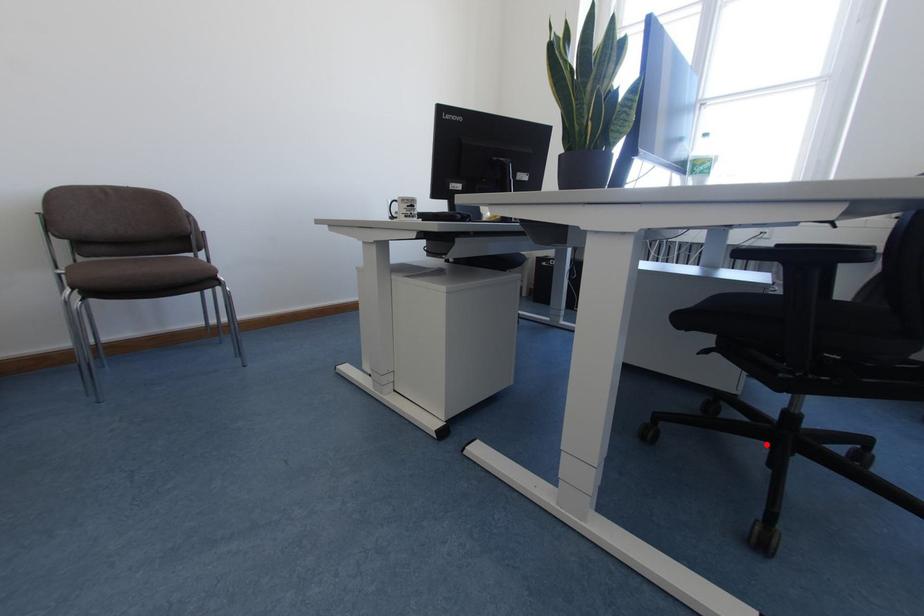
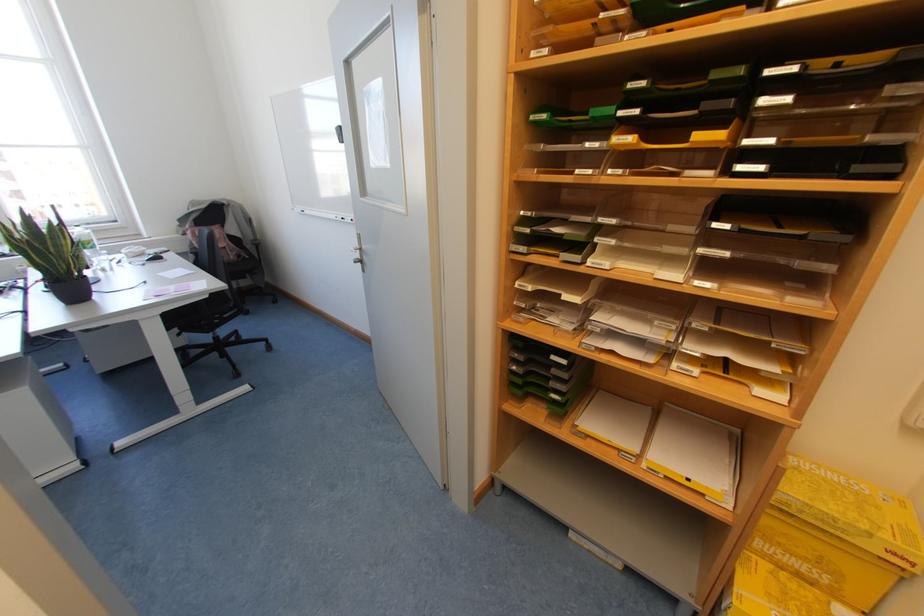
In the second image, find the point that corresponds to the highlighted location in the first image.

(215, 351)